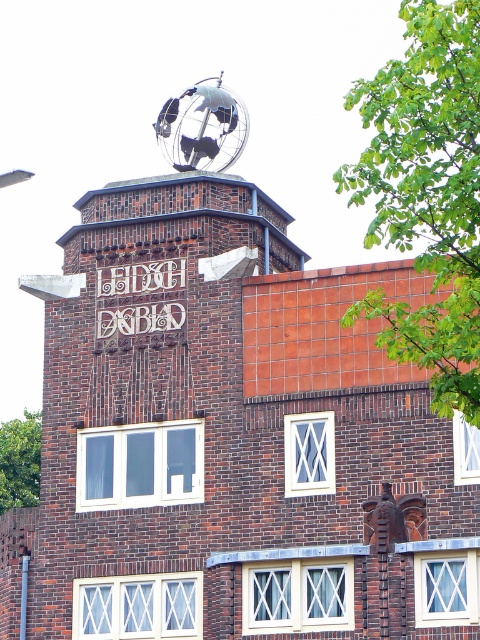
Question: From the image, what is the correct spatial relationship of metallic globe at top in relation to white ceramic sign at center?

Choices:
 (A) below
 (B) above

Answer: (B)

Question: Which point is closer to the camera?

Choices:
 (A) white ceramic sign at center
 (B) metallic globe at top

Answer: (A)

Question: Which point is closer to the camera?

Choices:
 (A) metallic globe at top
 (B) white ceramic sign at center

Answer: (B)

Question: Can you confirm if metallic globe at top is positioned to the left of white ceramic sign at center?

Choices:
 (A) no
 (B) yes

Answer: (A)

Question: Is metallic globe at top thinner than white ceramic sign at center?

Choices:
 (A) no
 (B) yes

Answer: (A)